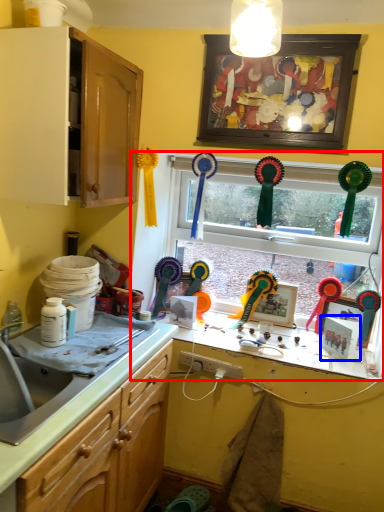
Question: Which of the following is the farthest to the observer, window (highlighted by a red box) or picture frame (highlighted by a blue box)?

Choices:
 (A) window
 (B) picture frame

Answer: (A)